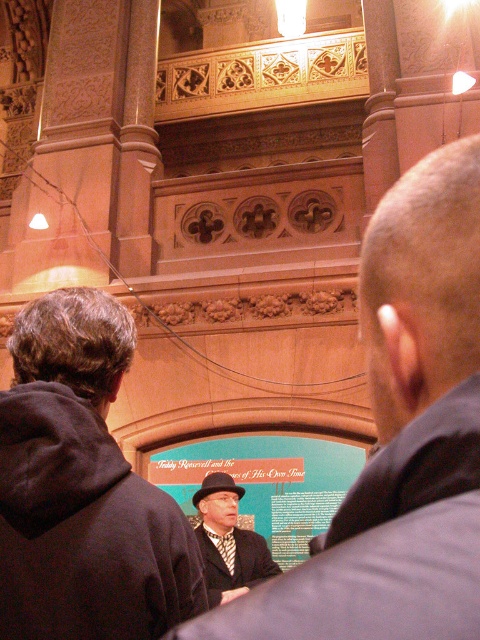
Is dark gray hoodie at center thinner than matte black hat at center?

No, dark gray hoodie at center is not thinner than matte black hat at center.

Which is above, dark gray hoodie at center or matte black hat at center?

Positioned higher is dark gray hoodie at center.

The width and height of the screenshot is (480, 640). What do you see at coordinates (83, 488) in the screenshot?
I see `dark gray hoodie at center` at bounding box center [83, 488].

Where is `dark gray hoodie at center`? dark gray hoodie at center is located at coordinates (83, 488).

Which is in front, point (117, 628) or point (256, 509)?

Point (117, 628)

Can you confirm if dark gray hoodie at center is wider than teal matte signboard at center?

In fact, dark gray hoodie at center might be narrower than teal matte signboard at center.

In order to click on dark gray hoodie at center in this screenshot , I will do `click(83, 488)`.

What are the coordinates of `dark gray hoodie at center` in the screenshot? It's located at 83,488.

Image resolution: width=480 pixels, height=640 pixels. In order to click on teal matte signboard at center in this screenshot , I will do `click(267, 483)`.

Which of these two, teal matte signboard at center or matte black hat at center, stands taller?

teal matte signboard at center is taller.

Is point (284, 554) positioned behind point (236, 545)?

That is True.

Find the location of a particular element. The image size is (480, 640). teal matte signboard at center is located at coordinates (267, 483).